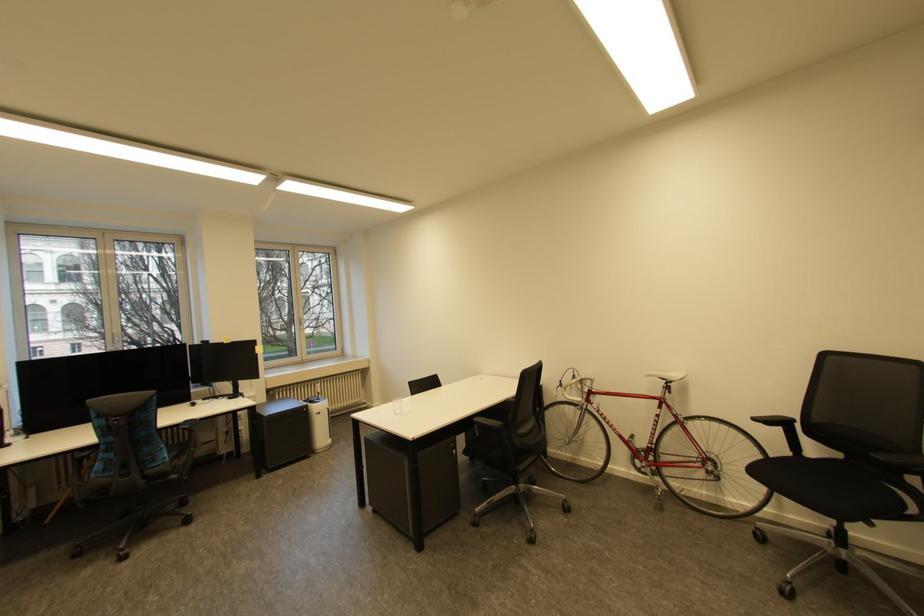
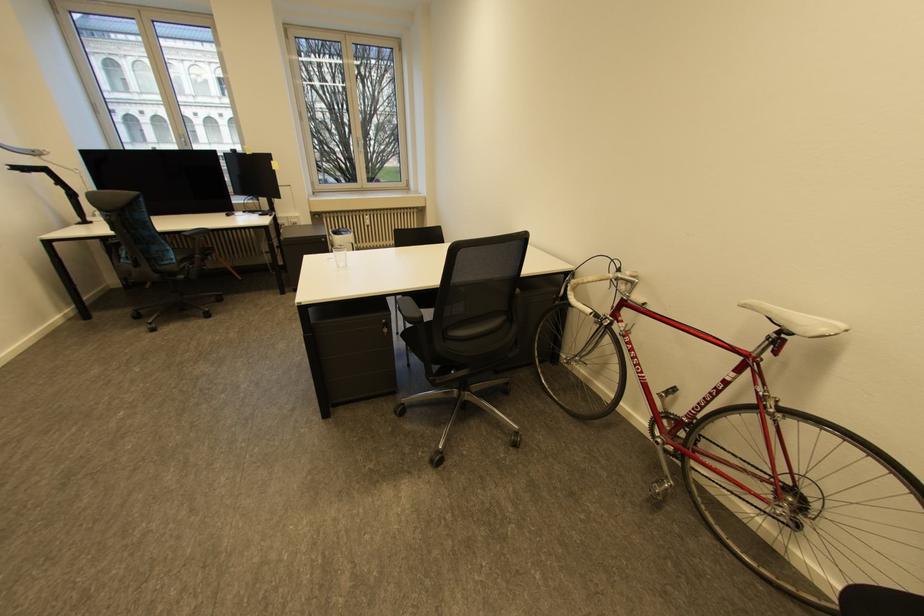
The point at (310, 323) is marked in the first image. Where is the corresponding point in the second image?

(367, 143)